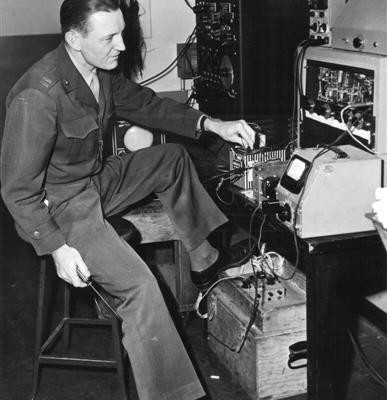
I want to click on wall, so click(x=30, y=24), click(x=27, y=48).